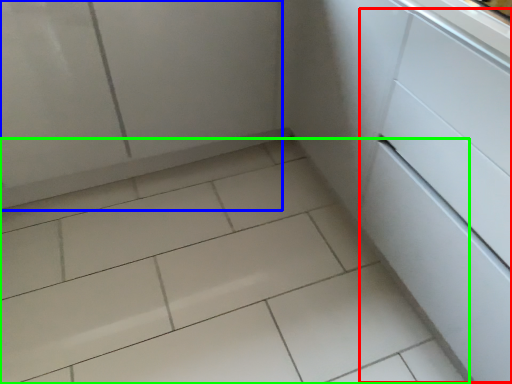
Question: Based on their relative distances, which object is nearer to drawer (highlighted by a red box)? Choose from screen door (highlighted by a blue box) and ceramic tile (highlighted by a green box).

Choices:
 (A) screen door
 (B) ceramic tile

Answer: (B)